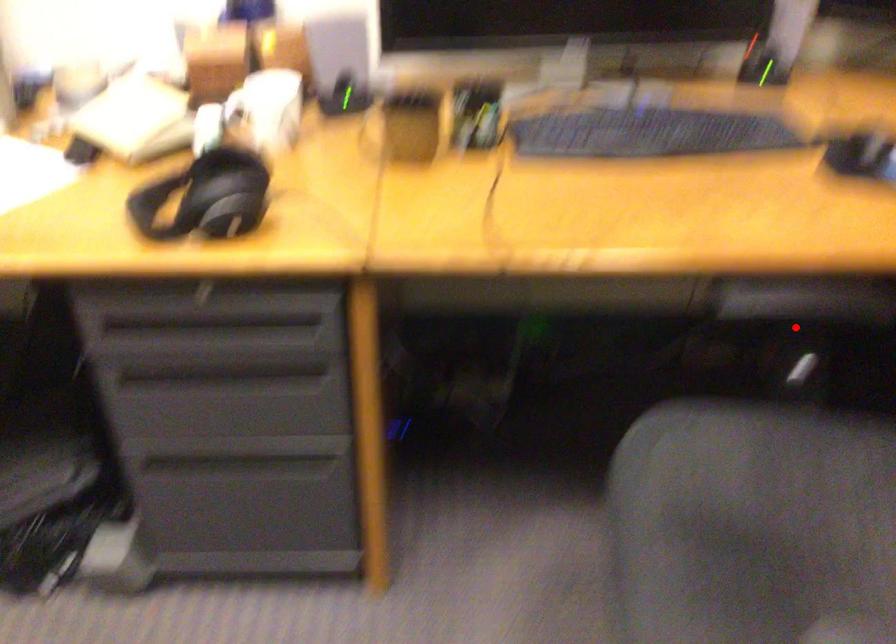
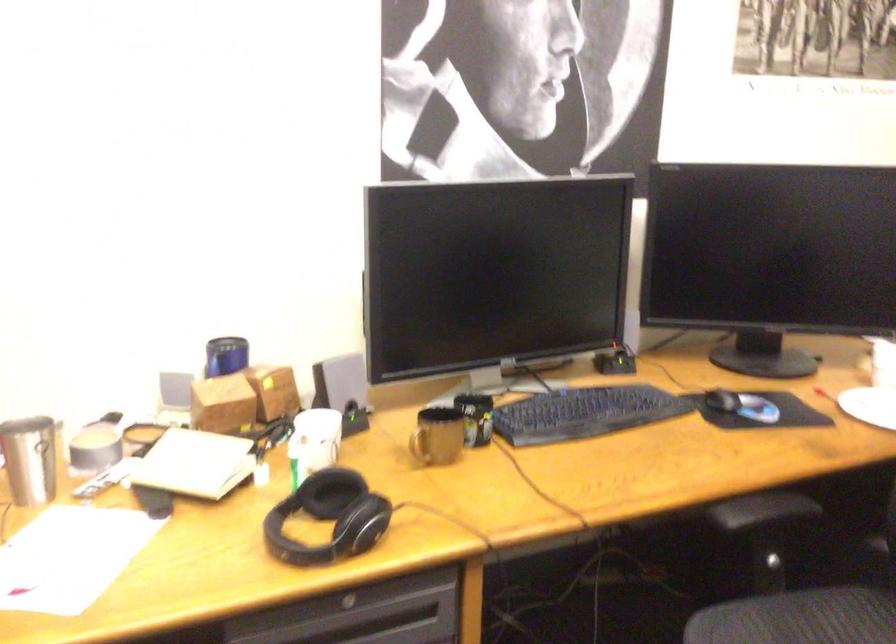
In the second image, find the point that corresponds to the highlighted location in the first image.

(762, 529)